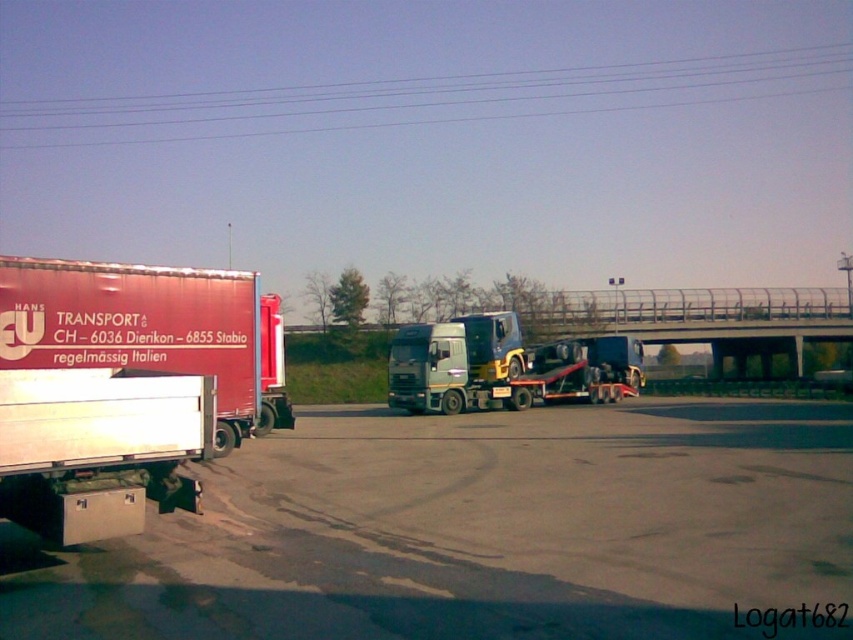
You are a delivery driver who needs to park your truck behind the metallic silver truck at center without hitting the metallic wires at upper center. Can you do it safely?

The metallic wires at upper center are closer to you than the metallic silver truck at center, so you can safely park behind the metallic silver truck at center without hitting the wires.

What is the 2D coordinate of the gray asphalt tarmac at lower center in the image?

The gray asphalt tarmac at lower center is located at the 2D coordinate point of (479,531).